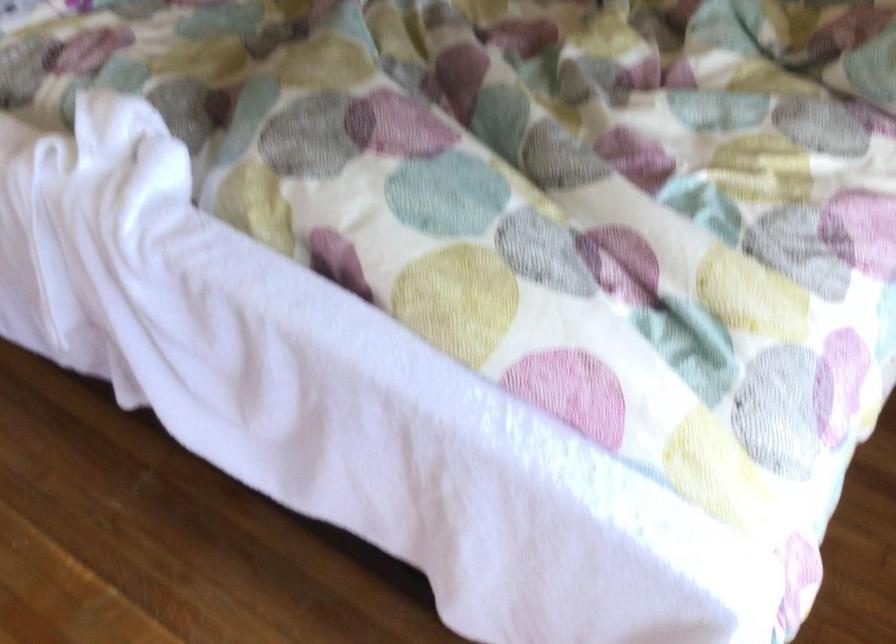
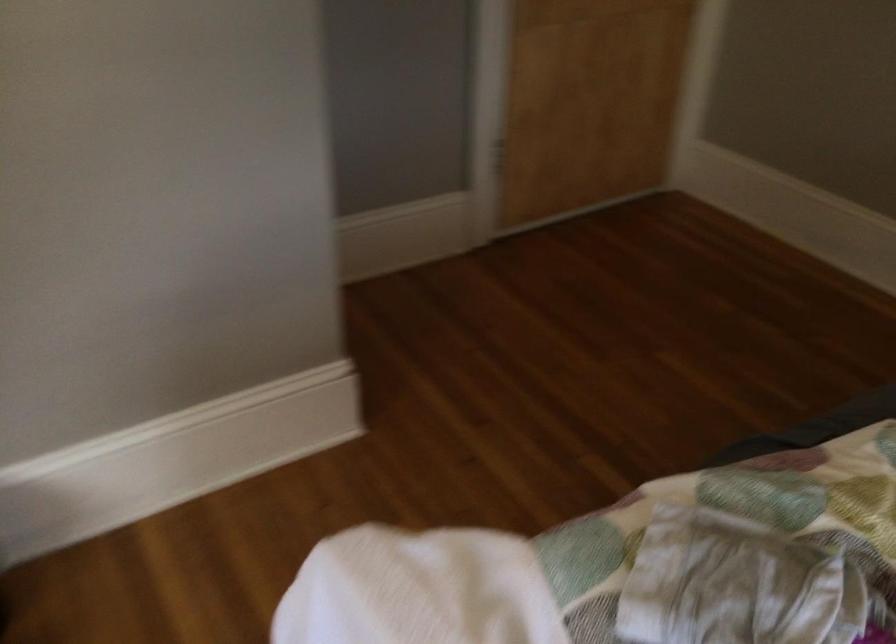
Question: The first image is from the beginning of the video and the second image is from the end. How did the camera likely rotate when shooting the video?

Choices:
 (A) Left
 (B) Right
 (C) Up
 (D) Down

Answer: (A)